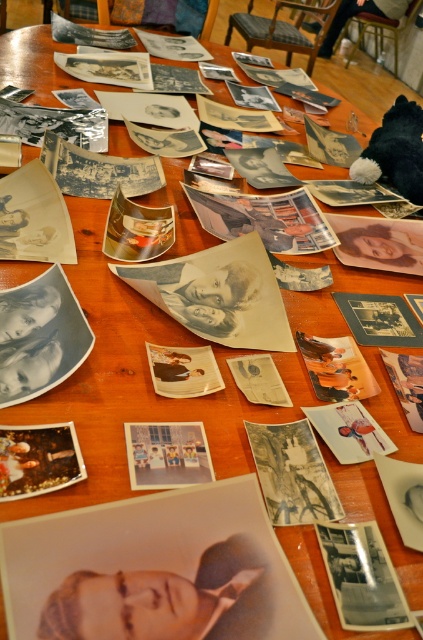
Question: Is matte paper portrait at center to the left of matte paper photo at center from the viewer's perspective?

Choices:
 (A) no
 (B) yes

Answer: (B)

Question: Can you confirm if matte paper portrait at center is positioned below matte paper photo at center?

Choices:
 (A) no
 (B) yes

Answer: (B)

Question: Is matte paper portrait at center below matte paper photo at center?

Choices:
 (A) yes
 (B) no

Answer: (A)